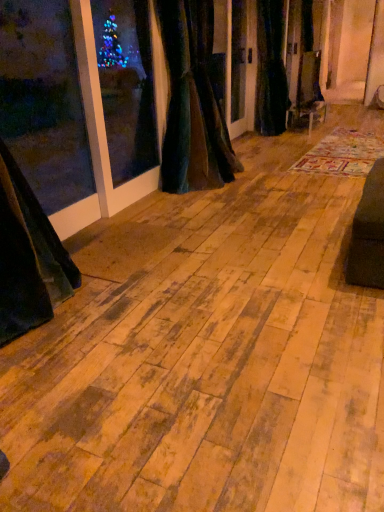
Locate an element on the screen. Image resolution: width=384 pixels, height=512 pixels. vacant area that is in front of velvet dark green curtain at center, which is counted as the 2th curtain, starting from the back is located at coordinates (209, 206).